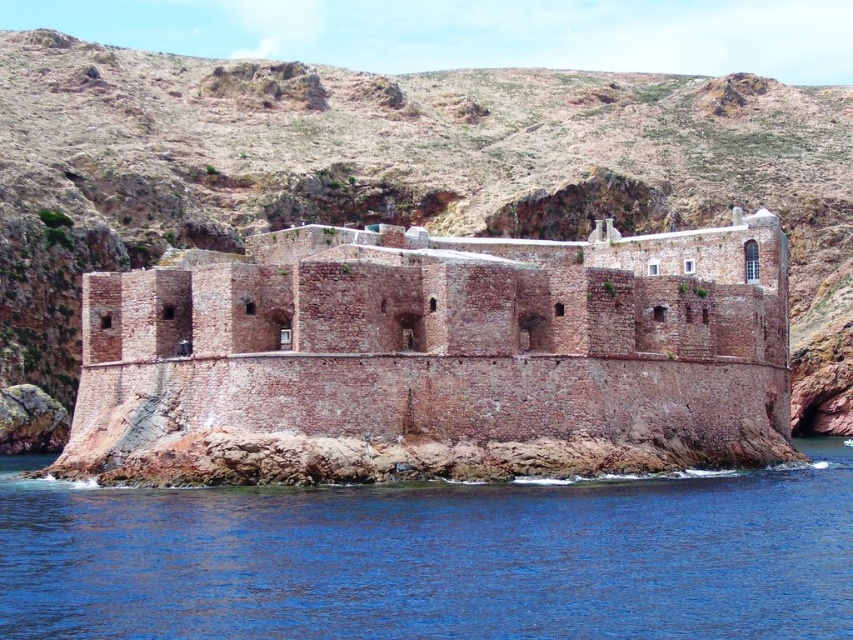
You are standing at the base of the fortress and want to reach the rustic stone hillside at upper center. Based on the distance provided, can you estimate how long it would take to walk there at a leisurely pace of 3 miles per hour?

The distance between you and the rustic stone hillside at upper center is 314.93 feet. At a leisurely pace of 3 miles per hour, it would take approximately 1 minute and 10 seconds to walk this distance.

You are a tourist standing at the base of the fortress and want to take a photo of the rustic stone hillside at upper center and the blue water at lower left. Which object should you frame first in your camera to ensure both are visible in the shot?

You should frame the rustic stone hillside at upper center first because it is positioned to the left of the blue water at lower left, so capturing its left position ensures both are included in the photo.

You are standing at the base of the fortress and want to reach the observation deck located at point (126, 266). However, there is a guard tower at point (576, 416). From your current position, which point is closer to you?

Point (126, 266) is closer to you because it is behind point (576, 416), meaning the guard tower is between you and the observation deck.